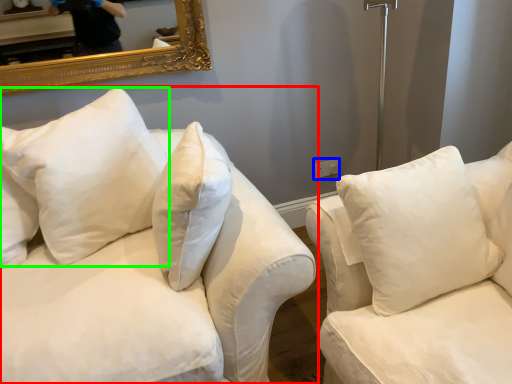
Question: Which object is positioned closest to studio couch (highlighted by a red box)? Select from electric outlet (highlighted by a blue box) and pillow (highlighted by a green box).

Choices:
 (A) electric outlet
 (B) pillow

Answer: (B)